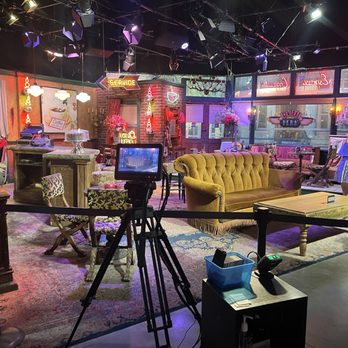
At what (x,y) coordinates should I click in order to perform the action: click on table leg. Please return your answer as a coordinate pair (x, y). Looking at the image, I should click on pyautogui.click(x=304, y=245).